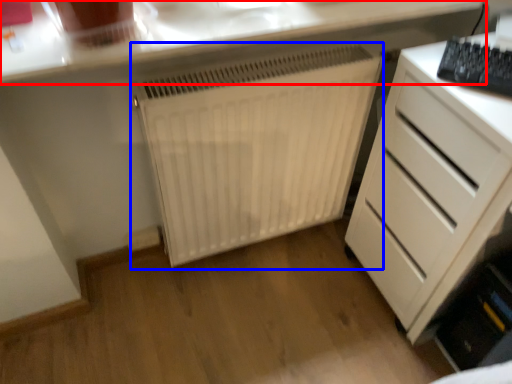
Question: Which object appears farthest to the camera in this image, countertop (highlighted by a red box) or radiator (highlighted by a blue box)?

Choices:
 (A) countertop
 (B) radiator

Answer: (B)